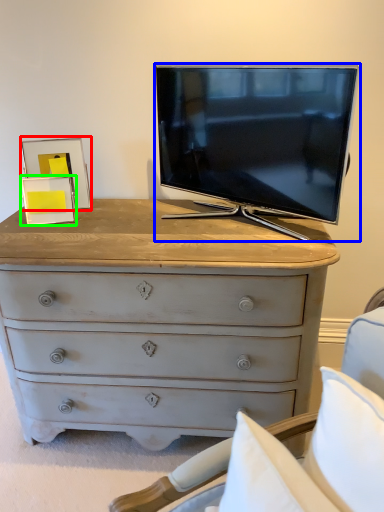
Question: Estimate the real-world distances between objects in this image. Which object is closer to picture frame (highlighted by a red box), television (highlighted by a blue box) or picture frame (highlighted by a green box)?

Choices:
 (A) television
 (B) picture frame

Answer: (B)